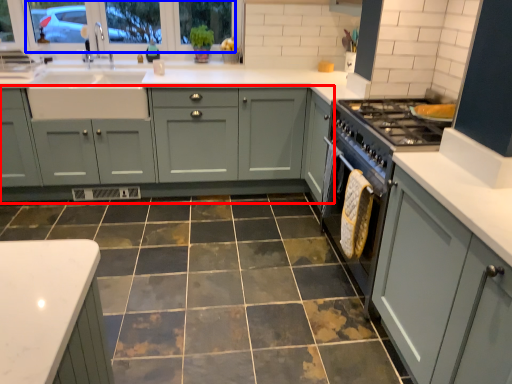
Question: Which object appears closest to the camera in this image, cabinetry (highlighted by a red box) or window screen (highlighted by a blue box)?

Choices:
 (A) cabinetry
 (B) window screen

Answer: (A)